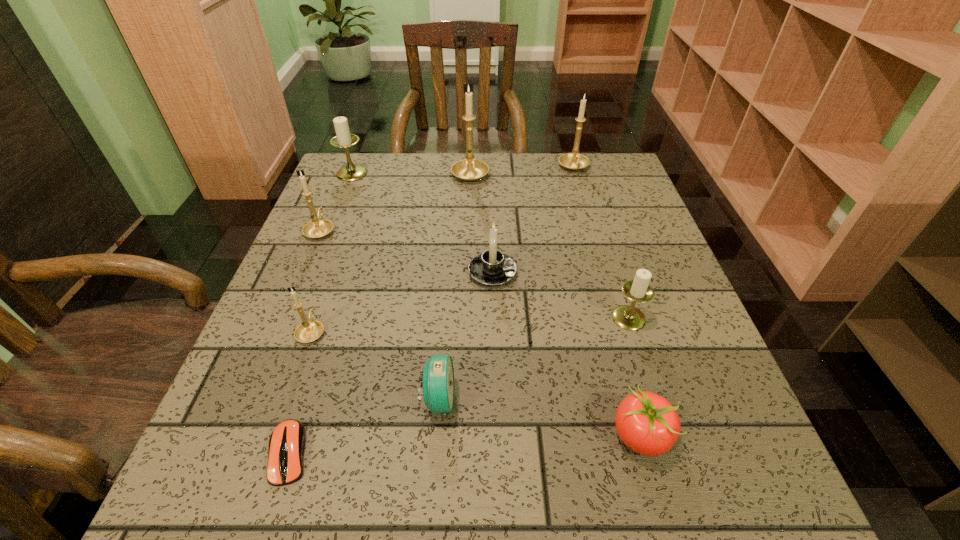
The width and height of the screenshot is (960, 540). What are the coordinates of `tomato that is positioned at the near edge` in the screenshot? It's located at (647, 423).

The height and width of the screenshot is (540, 960). What are the coordinates of `computer mouse that is positioned at the near edge` in the screenshot? It's located at (286, 447).

Image resolution: width=960 pixels, height=540 pixels. What are the coordinates of `computer mouse present at the left edge` in the screenshot? It's located at (286, 447).

Locate an element on the screen. The width and height of the screenshot is (960, 540). tomato positioned at the right edge is located at coordinates (647, 423).

I want to click on object that is at the far left corner, so click(343, 139).

You are a GUI agent. You are given a task and a screenshot of the screen. Output one action in this format:
    pyautogui.click(x=<x>, y=<y>)
    Task: Click on the object at the near left corner
    This screenshot has height=540, width=960.
    Given the screenshot: What is the action you would take?
    pyautogui.click(x=286, y=447)

Locate an element on the screen. This screenshot has width=960, height=540. object positioned at the far right corner is located at coordinates (573, 161).

Find the location of a particular element. Image resolution: width=960 pixels, height=540 pixels. object at the near right corner is located at coordinates (647, 423).

The image size is (960, 540). In the image, there is a desktop. In order to click on vacant space at the far edge in this screenshot , I will do `click(504, 159)`.

You are a GUI agent. You are given a task and a screenshot of the screen. Output one action in this format:
    pyautogui.click(x=<x>, y=<y>)
    Task: Click on the vacant region at the near edge of the desktop
    The height and width of the screenshot is (540, 960).
    Given the screenshot: What is the action you would take?
    pyautogui.click(x=654, y=481)